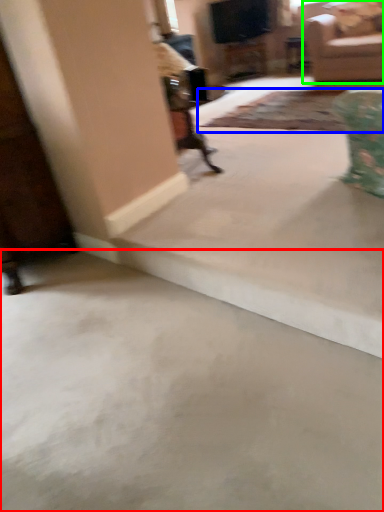
Question: Considering the real-world distances, which object is farthest from concrete (highlighted by a red box)? mat (highlighted by a blue box) or studio couch (highlighted by a green box)?

Choices:
 (A) mat
 (B) studio couch

Answer: (B)